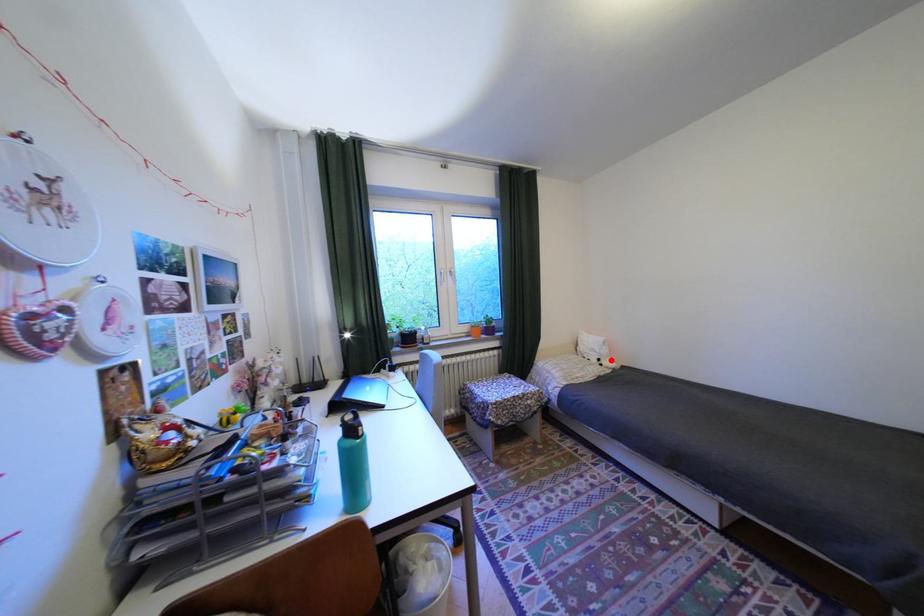
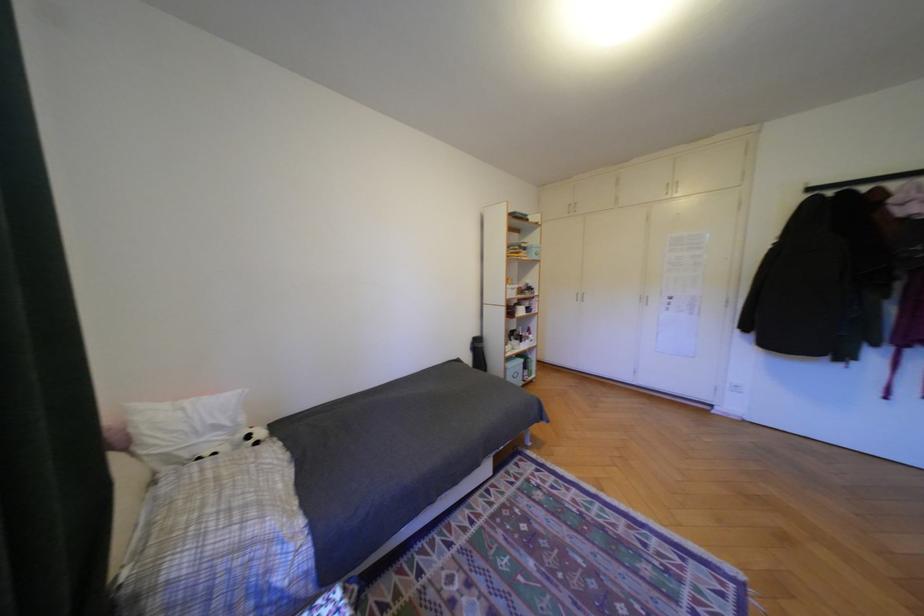
Find the pixel in the second image that matches the highlighted location in the first image.

(261, 437)